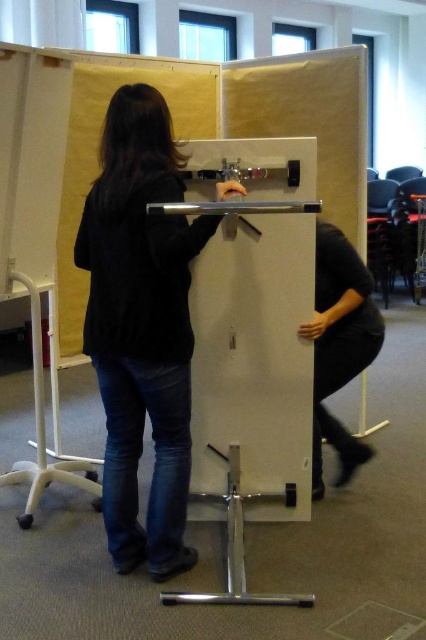
Based on the scene description, where is the white matte easel at center located in terms of its 2D coordinates?

The white matte easel at center is located at the 2D coordinates of point (252, 353).

You are a painter who needs to place a 14 inch wide canvas between the white matte easel at center and the black matte sweater at center. Can you fit it there?

The distance between the white matte easel at center and the black matte sweater at center is 13.79 inches, so the 14 inch wide canvas would not fit as it is slightly wider than the available space.

You are an artist preparing to set up your painting supplies. You have a white matte easel at center and a black matte sweater at center in front of you. Based on their positions, which object is closer to your right side?

The white matte easel at center is to the right of the black matte sweater at center, so it is closer to your right side.